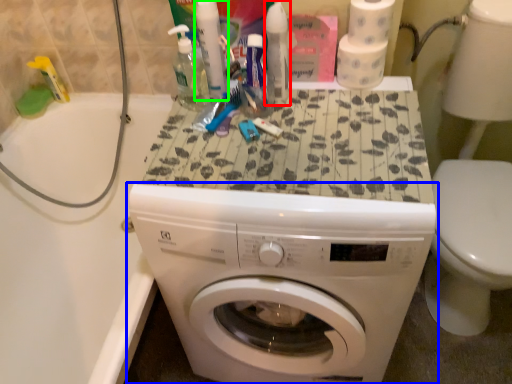
Question: Based on their relative distances, which object is farther from cleaning product (highlighted by a red box)? Choose from washing machine (highlighted by a blue box) and toiletry (highlighted by a green box).

Choices:
 (A) washing machine
 (B) toiletry

Answer: (A)